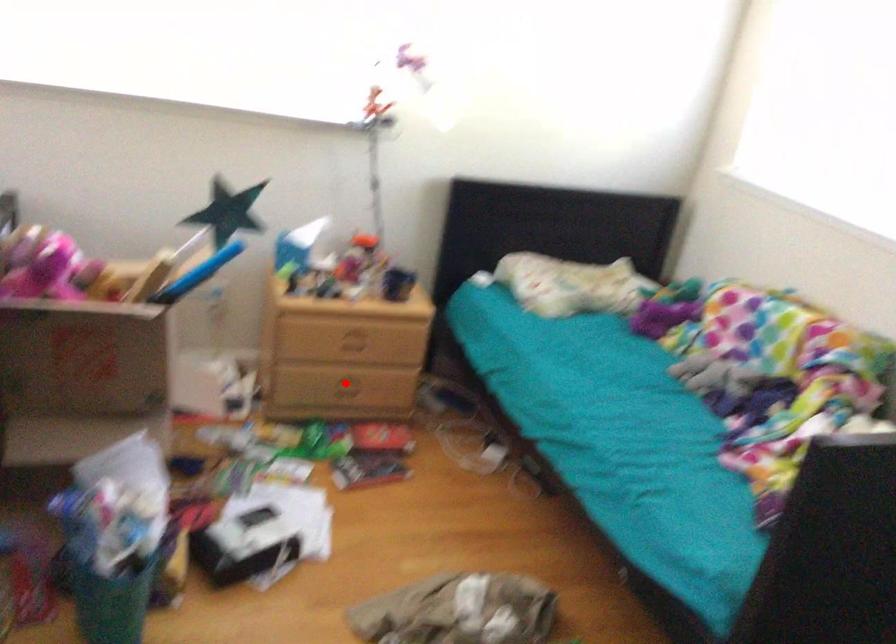
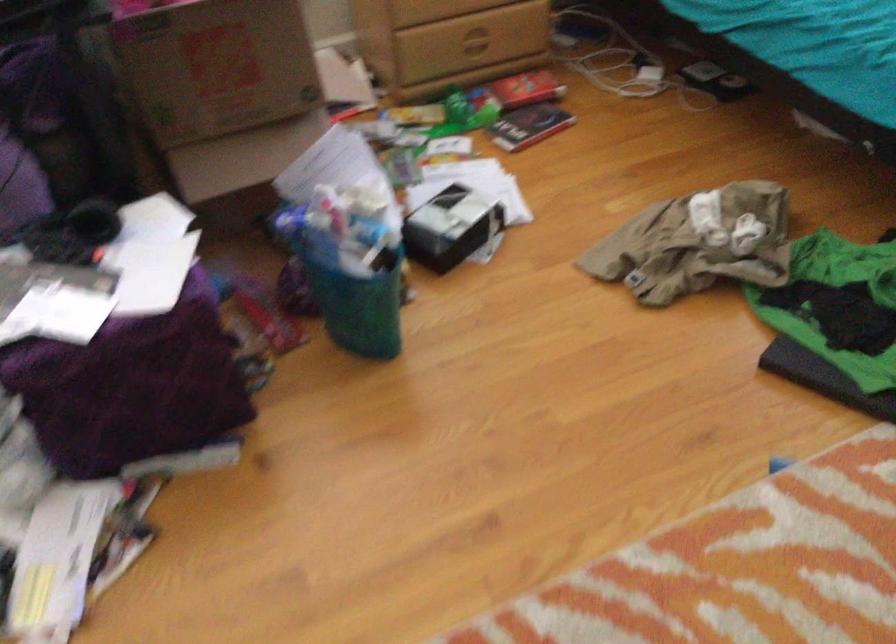
In the second image, find the point that corresponds to the highlighted location in the first image.

(472, 40)